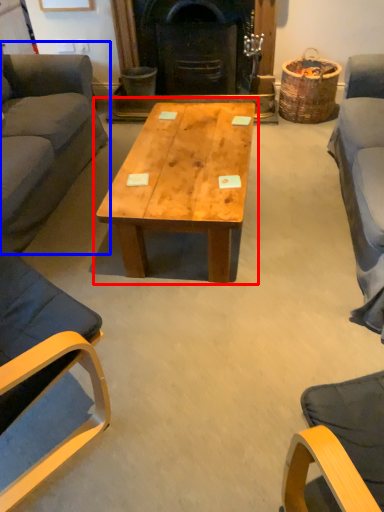
Question: Which object is closer to the camera taking this photo, coffee table (highlighted by a red box) or studio couch (highlighted by a blue box)?

Choices:
 (A) coffee table
 (B) studio couch

Answer: (B)